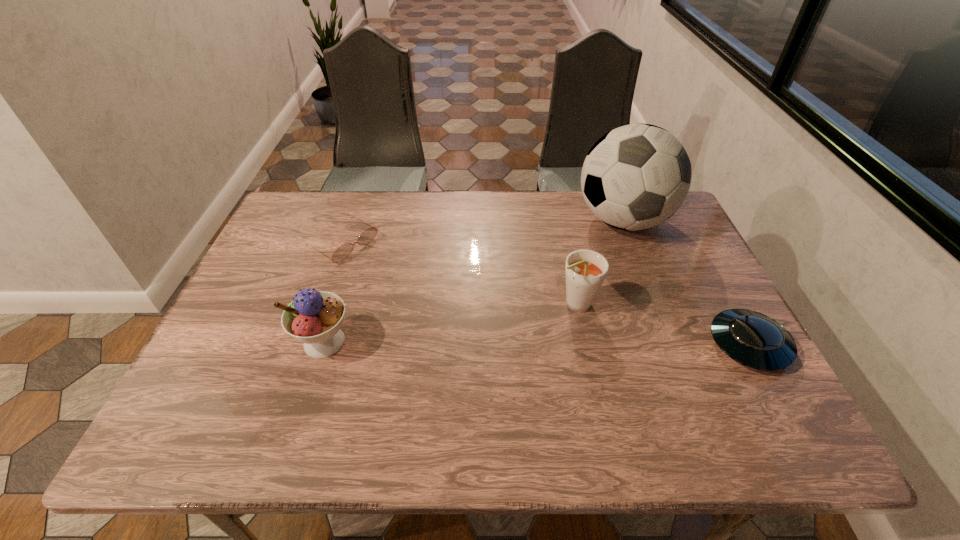
The height and width of the screenshot is (540, 960). I want to click on free space on the desktop that is between the icecream and the saucer and is positioned on the drink side of the root beer, so click(504, 343).

Where is `vacant space on the desktop that is between the icecream and the fourth tallest object and is positioned on the main logo of the soccer ball`? This screenshot has height=540, width=960. vacant space on the desktop that is between the icecream and the fourth tallest object and is positioned on the main logo of the soccer ball is located at coordinates (544, 343).

Identify the location of free spot on the desktop that is between the icecream and the fourth tallest object and is positioned on the face of the shortest object. The width and height of the screenshot is (960, 540). (514, 343).